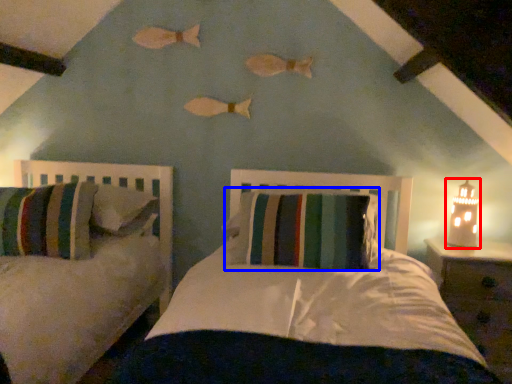
Question: Which object appears farthest to the camera in this image, table lamp (highlighted by a red box) or pillow (highlighted by a blue box)?

Choices:
 (A) table lamp
 (B) pillow

Answer: (A)